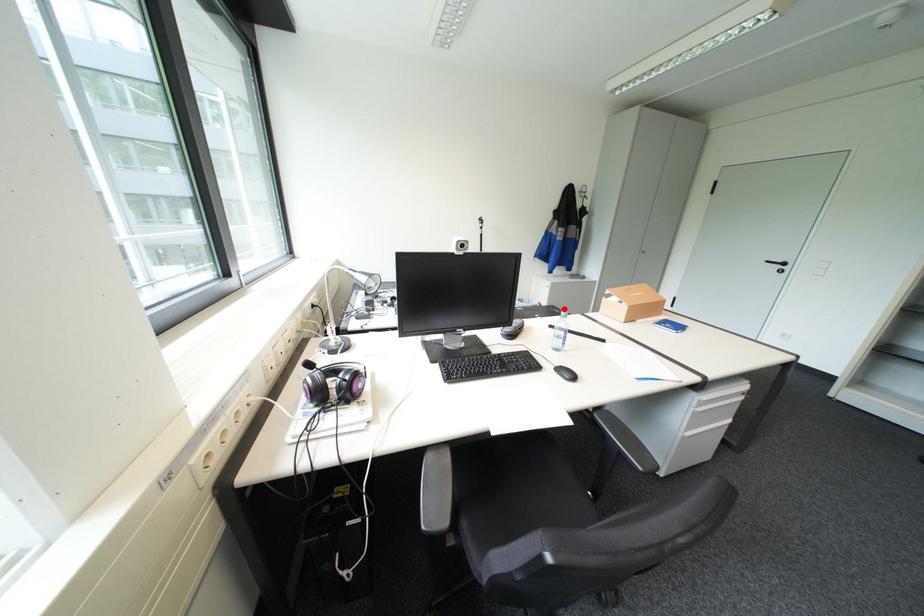
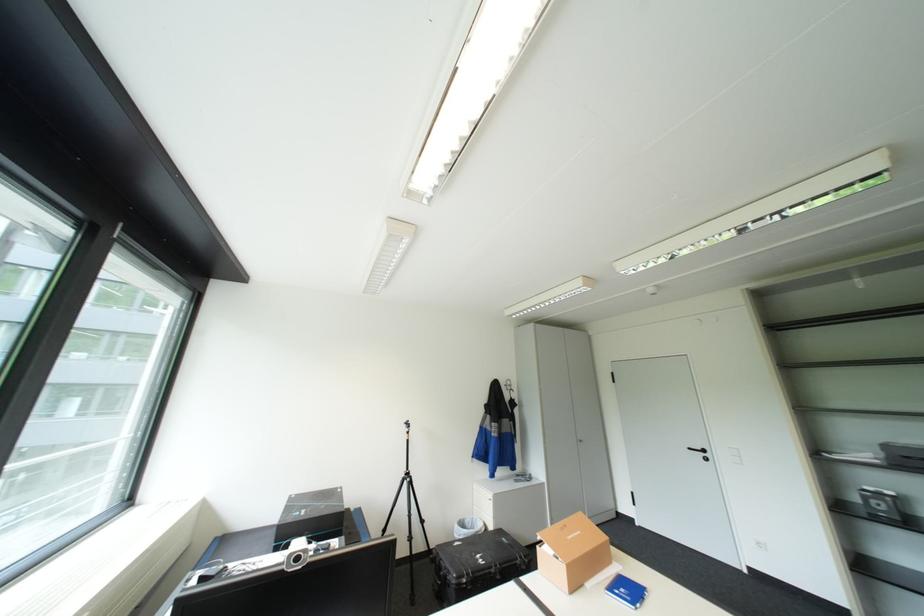
Question: I am providing you with two images of the same scene from different viewpoints. Image1 has a red point marked. In image2, the corresponding 3D location appears at what relative position? Reply with the corresponding letter.

Choices:
 (A) Closer
 (B) Farther

Answer: (B)